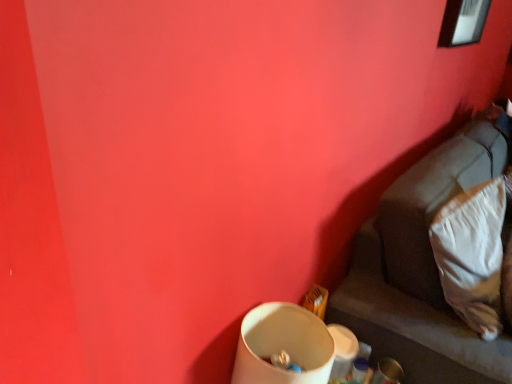
Question: From their relative heights in the image, would you say suede-like beige couch at lower right is taller or shorter than white soft pillow at lower right?

Choices:
 (A) tall
 (B) short

Answer: (A)

Question: Based on their sizes in the image, would you say suede-like beige couch at lower right is bigger or smaller than white soft pillow at lower right?

Choices:
 (A) small
 (B) big

Answer: (B)

Question: From the image's perspective, is suede-like beige couch at lower right positioned above or below white soft pillow at lower right?

Choices:
 (A) below
 (B) above

Answer: (A)

Question: Looking at their shapes, would you say white soft pillow at lower right is wider or thinner than suede-like beige couch at lower right?

Choices:
 (A) wide
 (B) thin

Answer: (B)

Question: In terms of height, does white soft pillow at lower right look taller or shorter compared to suede-like beige couch at lower right?

Choices:
 (A) tall
 (B) short

Answer: (B)

Question: In the image, is white soft pillow at lower right positioned in front of or behind suede-like beige couch at lower right?

Choices:
 (A) front
 (B) behind

Answer: (B)

Question: Is white soft pillow at lower right inside the boundaries of suede-like beige couch at lower right, or outside?

Choices:
 (A) inside
 (B) outside

Answer: (A)